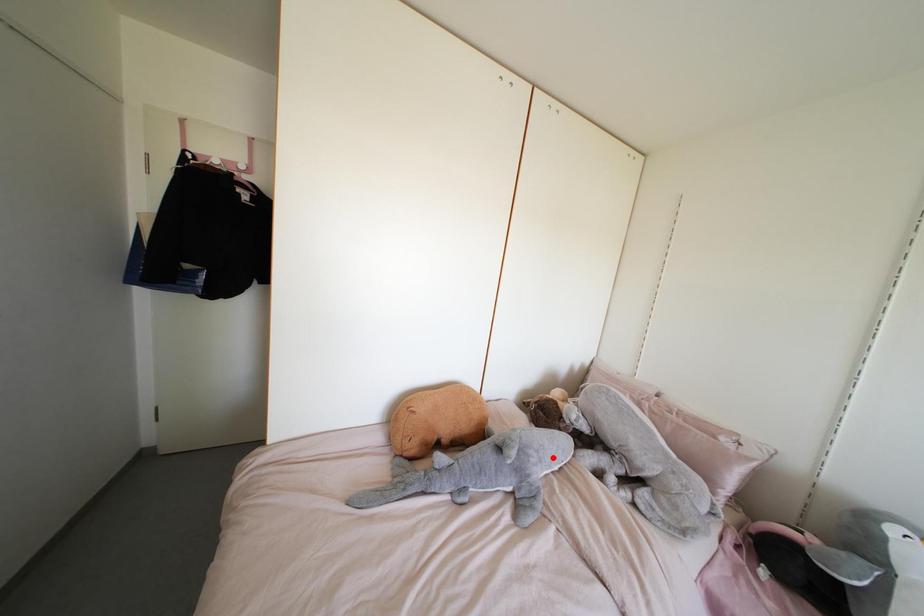
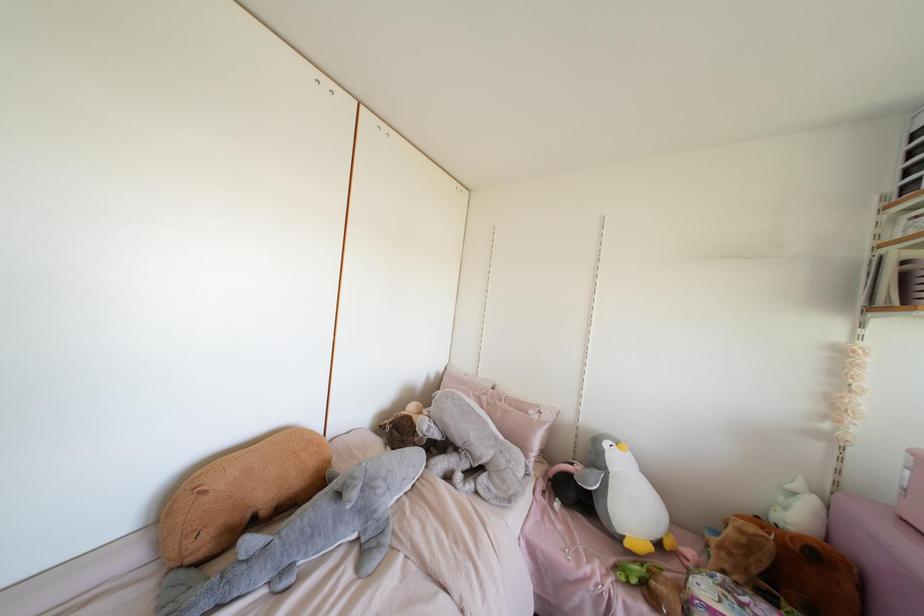
Question: I am providing you with two images of the same scene from different viewpoints. A red point is shown in image1. For the corresponding object point in image2, is it positioned nearer or farther from the camera?

Choices:
 (A) Nearer
 (B) Farther

Answer: (A)